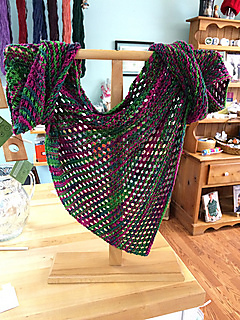
Find the location of a particular element. stand is located at coordinates (97, 262), (142, 268), (118, 255).